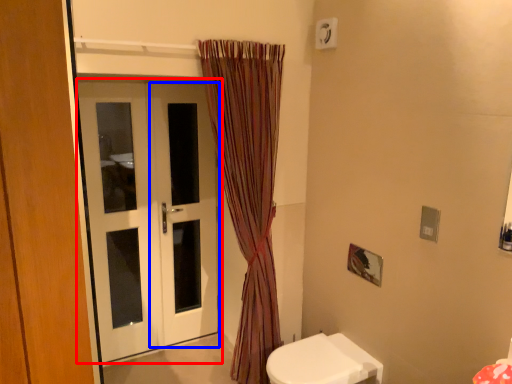
Question: Which object appears farthest to the camera in this image, door (highlighted by a red box) or screen door (highlighted by a blue box)?

Choices:
 (A) door
 (B) screen door

Answer: (B)